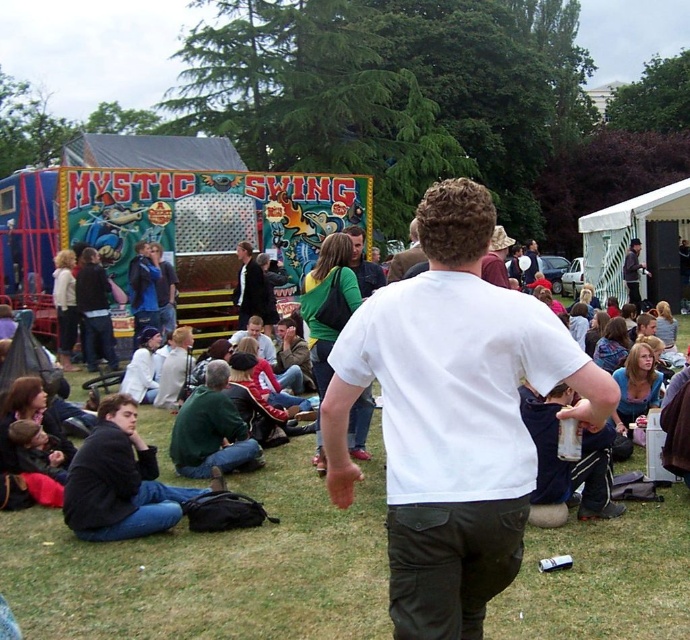
You are standing at the edge of the fairground and want to find the green grass at center. According to the coordinates provided, where should you look to locate it?

The green grass at center is located at point coordinates (213,566).

You are standing at the edge of the fairground and notice two green items in the scene. One is the green grass at center and the other is the green matte shirt at center. Which of these two items appears larger in size?

The green matte shirt at center appears larger than the green grass at center because the grass is described as smaller.